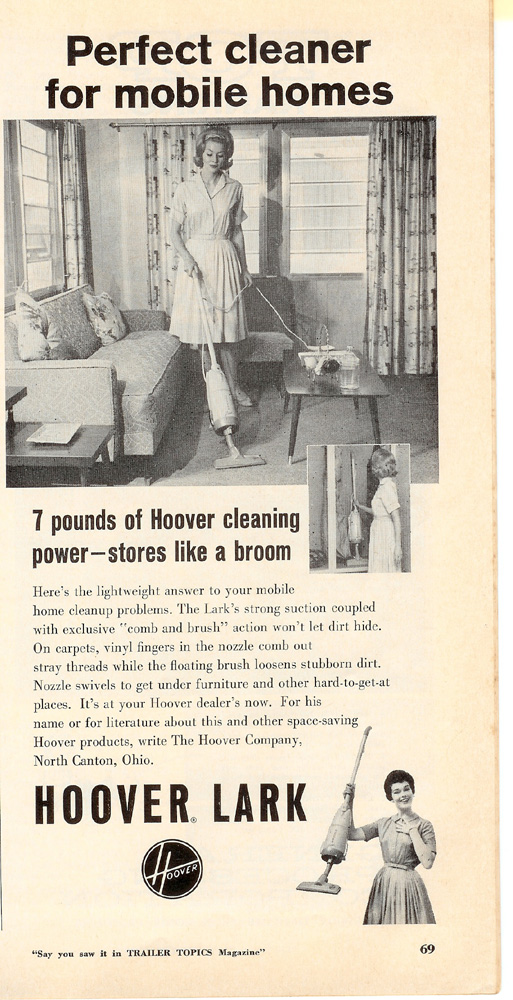
You are a GUI agent. You are given a task and a screenshot of the screen. Output one action in this format:
    pyautogui.click(x=<x>, y=<y>)
    Task: Click on the end tables
    The image size is (513, 1000).
    Given the screenshot: What is the action you would take?
    pyautogui.click(x=14, y=392), pyautogui.click(x=90, y=450)